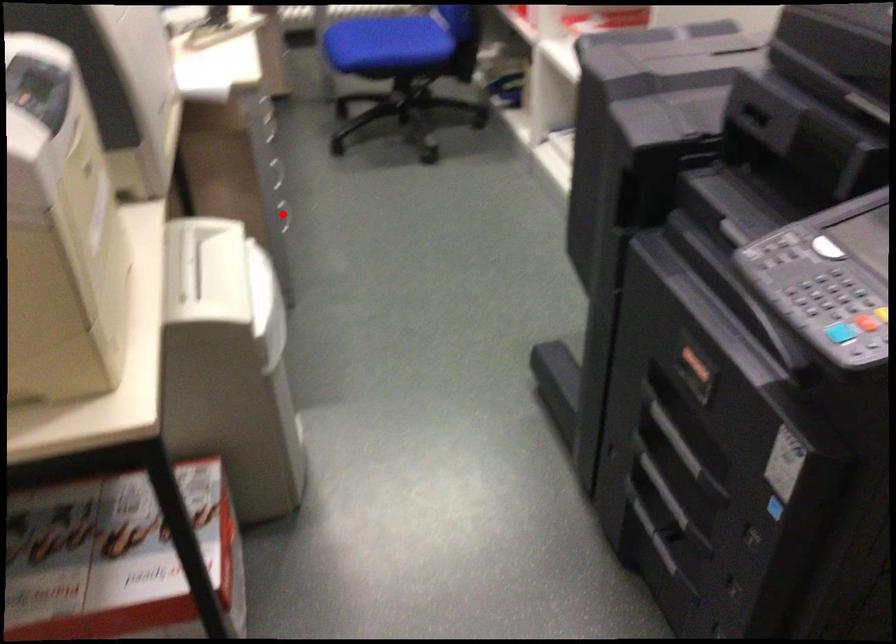
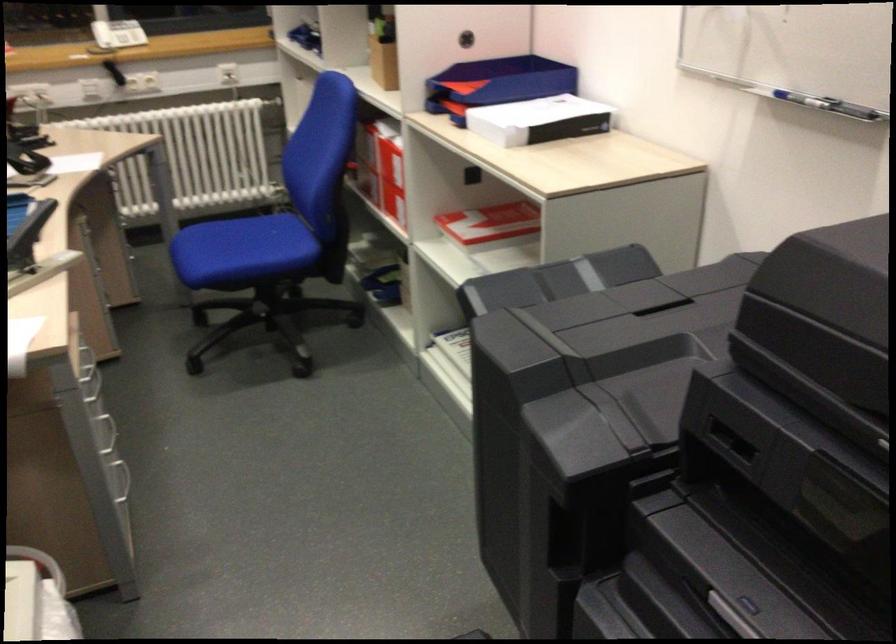
Where in the second image is the point corresponding to the highlighted location from the first image?

(118, 478)